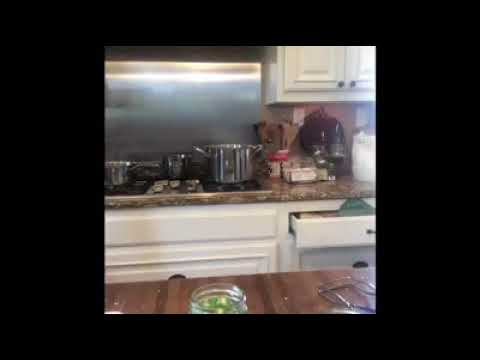
Locate an element on the screen. The width and height of the screenshot is (480, 360). counter top is located at coordinates (268, 290).